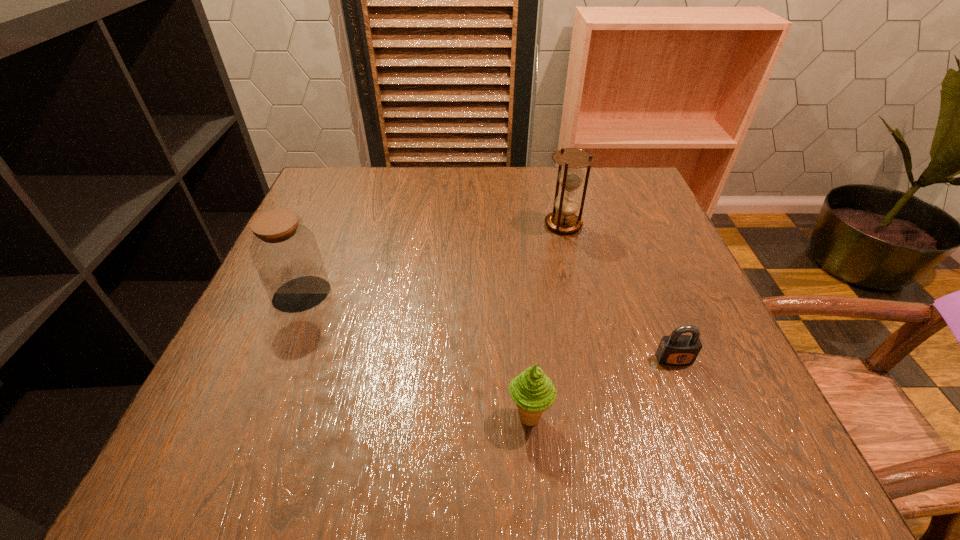
Locate an element on the screen. This screenshot has width=960, height=540. vacant space at the far left corner of the desktop is located at coordinates (344, 202).

You are a GUI agent. You are given a task and a screenshot of the screen. Output one action in this format:
    pyautogui.click(x=<x>, y=<y>)
    Task: Click on the free space at the near left corner of the desktop
    The width and height of the screenshot is (960, 540).
    Given the screenshot: What is the action you would take?
    pyautogui.click(x=251, y=423)

Where is `vacant space at the near right corner of the desktop`? The height and width of the screenshot is (540, 960). vacant space at the near right corner of the desktop is located at coordinates (758, 456).

You are a GUI agent. You are given a task and a screenshot of the screen. Output one action in this format:
    pyautogui.click(x=<x>, y=<y>)
    Task: Click on the vacant area between the third farthest object and the second shortest object
    The image size is (960, 540).
    Given the screenshot: What is the action you would take?
    pyautogui.click(x=602, y=388)

Find the location of `vacant area that lies between the second object from right to left and the padlock`. vacant area that lies between the second object from right to left and the padlock is located at coordinates click(x=618, y=292).

Find the location of `blank region between the hourglass and the padlock`. blank region between the hourglass and the padlock is located at coordinates (618, 292).

The width and height of the screenshot is (960, 540). Identify the location of empty space between the third tallest object and the third object from left to right. (546, 321).

Find the location of a particular element. This screenshot has width=960, height=540. free point between the jar and the nearest object is located at coordinates (416, 356).

Identify the location of empty space that is in between the padlock and the third tallest object. This screenshot has width=960, height=540. (602, 388).

You are a GUI agent. You are given a task and a screenshot of the screen. Output one action in this format:
    pyautogui.click(x=<x>, y=<y>)
    Task: Click on the vacant area that lies between the second nearest object and the second shortest object
    Image resolution: width=960 pixels, height=540 pixels.
    Given the screenshot: What is the action you would take?
    pyautogui.click(x=602, y=388)